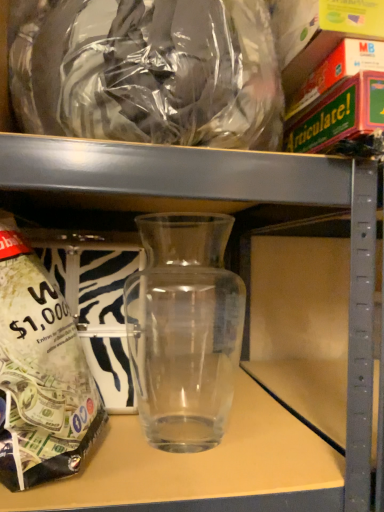
Question: From a real-world perspective, is transparent glass jar at left located higher than transparent plastic bag at upper center?

Choices:
 (A) no
 (B) yes

Answer: (A)

Question: Does transparent glass jar at left have a larger size compared to transparent plastic bag at upper center?

Choices:
 (A) no
 (B) yes

Answer: (B)

Question: Is transparent glass jar at left looking in the opposite direction of transparent plastic bag at upper center?

Choices:
 (A) no
 (B) yes

Answer: (A)

Question: From the image's perspective, is transparent glass jar at left under transparent plastic bag at upper center?

Choices:
 (A) no
 (B) yes

Answer: (B)

Question: Is transparent glass jar at left facing towards transparent plastic bag at upper center?

Choices:
 (A) no
 (B) yes

Answer: (A)

Question: From the image's perspective, relative to transparent glass vase at center, is transparent glass jar at left above or below?

Choices:
 (A) above
 (B) below

Answer: (B)

Question: Looking at the image, does transparent glass jar at left seem bigger or smaller compared to transparent glass vase at center?

Choices:
 (A) small
 (B) big

Answer: (B)

Question: Considering the positions of transparent glass jar at left and transparent glass vase at center in the image, is transparent glass jar at left wider or thinner than transparent glass vase at center?

Choices:
 (A) wide
 (B) thin

Answer: (A)

Question: From a real-world perspective, is transparent glass jar at left physically located above or below transparent glass vase at center?

Choices:
 (A) below
 (B) above

Answer: (A)

Question: Is transparent glass jar at left bigger or smaller than transparent plastic bag at upper center?

Choices:
 (A) small
 (B) big

Answer: (B)

Question: In terms of width, does transparent glass jar at left look wider or thinner when compared to transparent plastic bag at upper center?

Choices:
 (A) wide
 (B) thin

Answer: (A)

Question: Considering the relative positions of transparent glass jar at left and transparent plastic bag at upper center in the image provided, is transparent glass jar at left to the left or to the right of transparent plastic bag at upper center?

Choices:
 (A) right
 (B) left

Answer: (B)

Question: Which is correct: transparent glass jar at left is inside transparent plastic bag at upper center, or outside of it?

Choices:
 (A) inside
 (B) outside

Answer: (B)

Question: In the image, is transparent glass vase at center positioned in front of or behind transparent plastic bag at upper center?

Choices:
 (A) front
 (B) behind

Answer: (B)

Question: Is transparent glass vase at center situated inside transparent plastic bag at upper center or outside?

Choices:
 (A) outside
 (B) inside

Answer: (A)